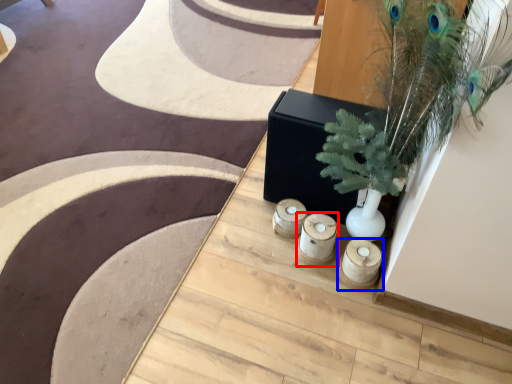
Question: Among these objects, which one is farthest to the camera, candle holder (highlighted by a red box) or candle holder (highlighted by a blue box)?

Choices:
 (A) candle holder
 (B) candle holder

Answer: (A)